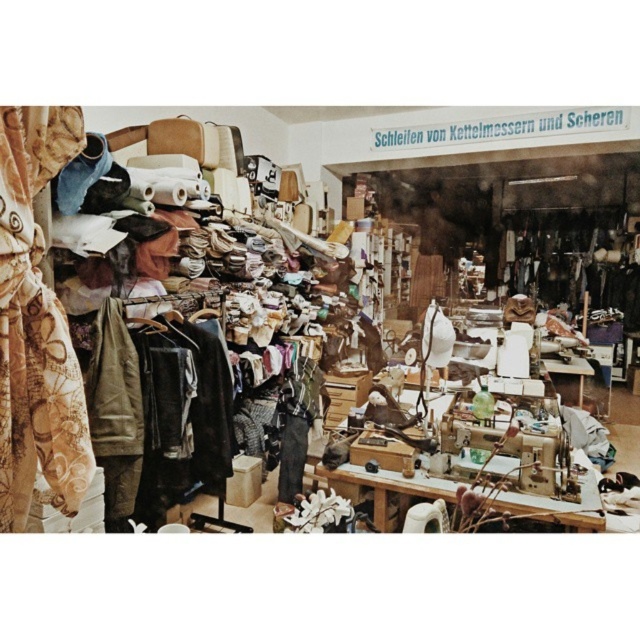
You are a tailor working in this workshop and need to move a pair of scissors from the beige floral fabric at left to the leather jacket at center. Given that the shortest path between them is 25.88 feet, is this distance too long for a typical tailor to comfortably reach without moving around the workspace?

The beige floral fabric at left and leather jacket at center are 25.88 feet apart from each other. This distance is quite long for a typical tailor to comfortably reach without moving around the workspace, as 25.88 feet is significantly longer than standard workspace distances.

You are in a workshop and need to determine which point is closer to you. You see two points labeled as point (552, 508) and point (60, 314). Which point is closer to you?

Point (60, 314) is closer to you because it is nearer than point (552, 508), which is further away.